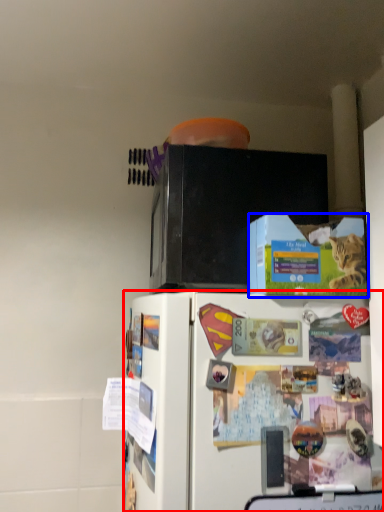
Question: Among these objects, which one is nearest to the camera, refrigerator (highlighted by a red box) or box (highlighted by a blue box)?

Choices:
 (A) refrigerator
 (B) box

Answer: (A)